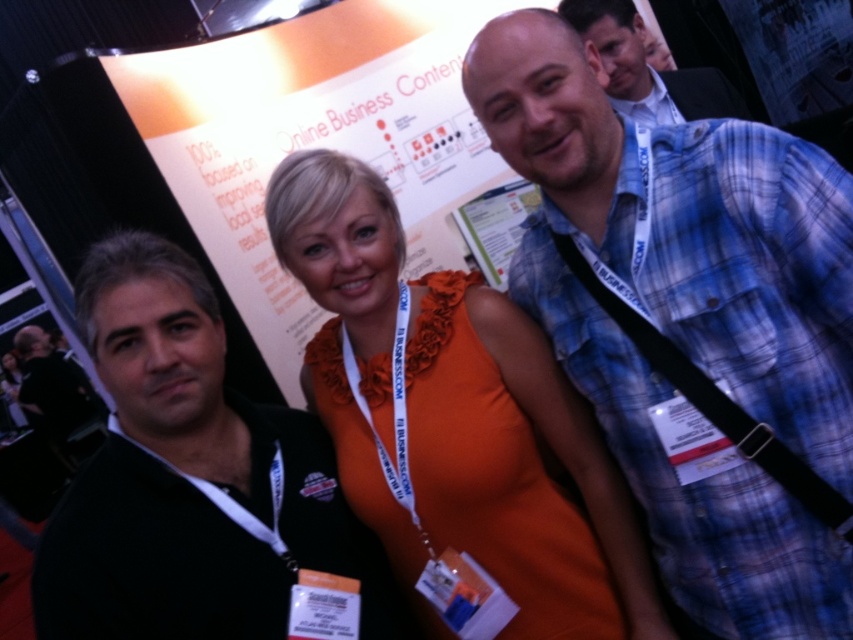
Question: Which object is closer to the camera taking this photo?

Choices:
 (A) black leather jacket at left
 (B) blue plaid shirt at center
 (C) blue plaid shirt at upper right

Answer: (B)

Question: Can you confirm if blue plaid shirt at upper right is positioned above black leather jacket at left?

Choices:
 (A) yes
 (B) no

Answer: (A)

Question: Is blue plaid shirt at center to the left of black fabric lanyard at right from the viewer's perspective?

Choices:
 (A) yes
 (B) no

Answer: (A)

Question: Is blue plaid shirt at center below blue plaid shirt at upper right?

Choices:
 (A) no
 (B) yes

Answer: (B)

Question: Among these objects, which one is nearest to the camera?

Choices:
 (A) black leather jacket at left
 (B) blue plaid shirt at upper right

Answer: (B)

Question: Which is nearer to the black leather jacket at left?

Choices:
 (A) orange satin dress at center
 (B) blue plaid shirt at center

Answer: (A)